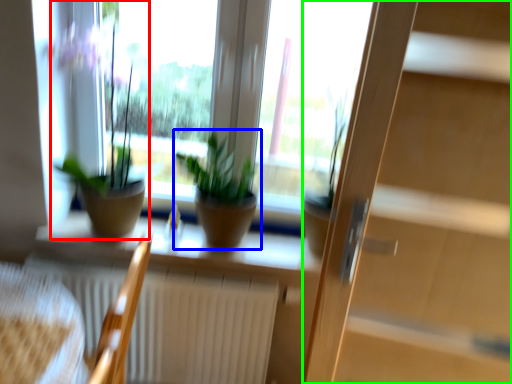
Question: Which object is positioned farthest from houseplant (highlighted by a red box)? Select from houseplant (highlighted by a blue box) and screen door (highlighted by a green box).

Choices:
 (A) houseplant
 (B) screen door

Answer: (B)